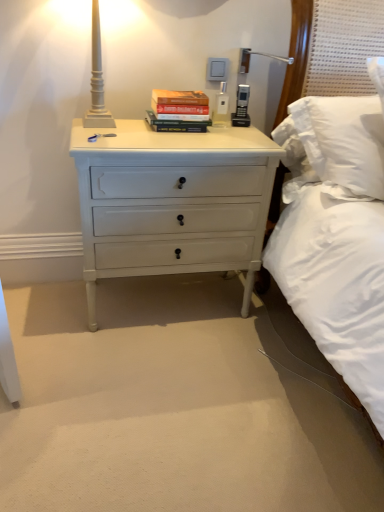
Question: Is white matte lamp at upper left taller or shorter than white painted wood chest of drawers at center?

Choices:
 (A) short
 (B) tall

Answer: (A)

Question: Looking at their shapes, would you say white matte lamp at upper left is wider or thinner than white painted wood chest of drawers at center?

Choices:
 (A) wide
 (B) thin

Answer: (B)

Question: Estimate the real-world distances between objects in this image. Which object is farther from the white matte lamp at upper left?

Choices:
 (A) white painted wood chest of drawers at center
 (B) hardcover book at center

Answer: (A)

Question: Which of these objects is positioned farthest from the white painted wood chest of drawers at center?

Choices:
 (A) white matte lamp at upper left
 (B) hardcover book at center

Answer: (A)